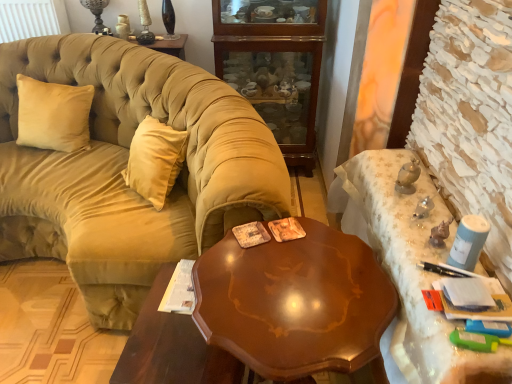
Image resolution: width=512 pixels, height=384 pixels. I want to click on free point above white lace tablecloth at right, which is the 1th desk from right to left (from a real-world perspective), so click(421, 219).